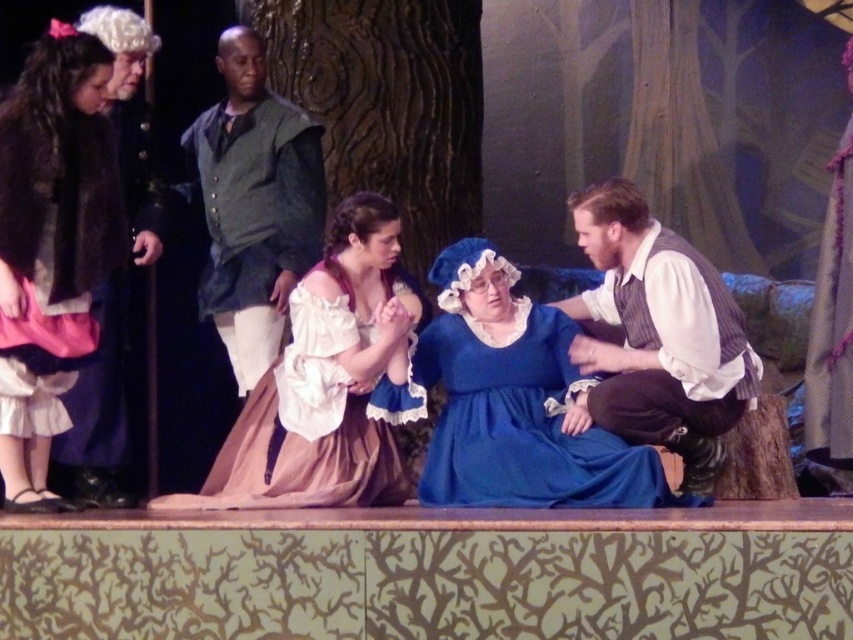
You are an assistant director observing the stage setup. You need to ensure that the white lace dress at center and the dark green fabric shirt at upper center are visible to the audience. Given their sizes, which one might require a more elevated position to ensure visibility?

The white lace dress at center occupies less space than the dark green fabric shirt at upper center, so the white lace dress at center might require a more elevated position to ensure visibility.

You are a costume designer observing the scene. You need to determine which costume requires more fabric based on their size. Which one between the white lace dress at center and the striped vest at center needs more fabric?

The striped vest at center requires more fabric than the white lace dress at center because it is larger in size.

You are a costume designer observing the scene and need to note the positions of the striped vest at center and the dark green fabric shirt at upper center. Which of these two items is positioned to the right of the other?

The striped vest at center is to the right of the dark green fabric shirt at upper center.